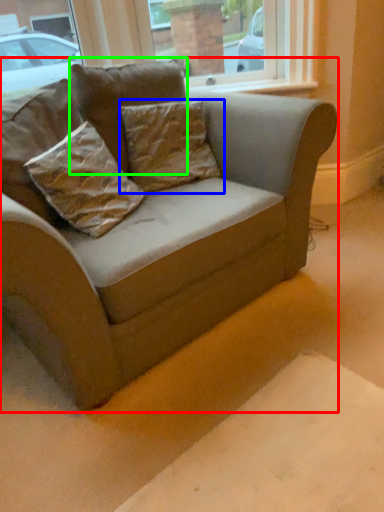
Question: Which object is positioned farthest from studio couch (highlighted by a red box)? Select from pillow (highlighted by a blue box) and pillow (highlighted by a green box).

Choices:
 (A) pillow
 (B) pillow

Answer: (B)